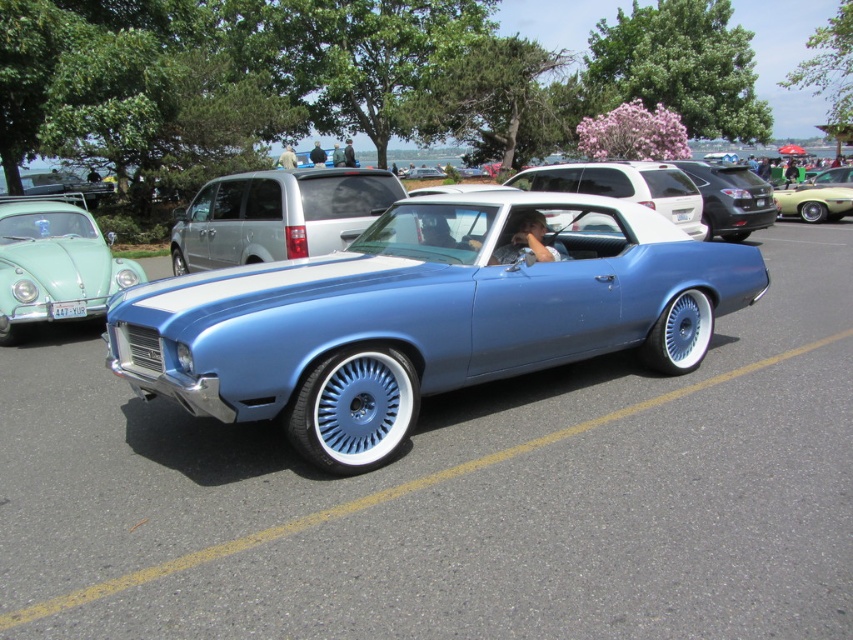
Question: Is metallic blue convertible at center thinner than matte green car at left?

Choices:
 (A) yes
 (B) no

Answer: (B)

Question: Which object is the farthest from the metallic blue car at center?

Choices:
 (A) satin black suv at center
 (B) metallic gold car at center

Answer: (B)

Question: Can you confirm if satin silver van at center is positioned to the right of metallic gold car at center?

Choices:
 (A) no
 (B) yes

Answer: (A)

Question: Among these objects, which one is farthest from the camera?

Choices:
 (A) metallic blue car at center
 (B) metallic blue convertible at center
 (C) satin silver van at center

Answer: (C)

Question: Which object is farther from the camera taking this photo?

Choices:
 (A) metallic blue convertible at center
 (B) satin silver van at center

Answer: (B)

Question: Is metallic blue car at center to the right of satin black suv at center from the viewer's perspective?

Choices:
 (A) yes
 (B) no

Answer: (B)